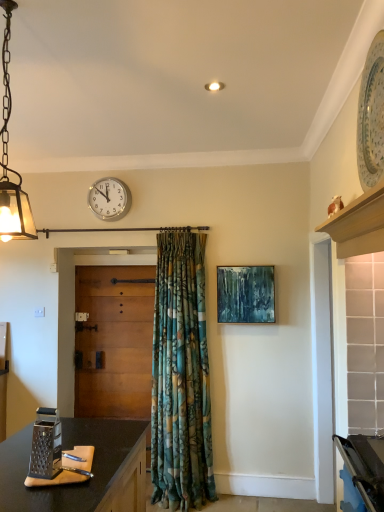
Question: From the image's perspective, is wooden door at center located above or below matte glass pendant light at left?

Choices:
 (A) below
 (B) above

Answer: (A)

Question: Looking at the image, does wooden door at center seem bigger or smaller compared to matte glass pendant light at left?

Choices:
 (A) big
 (B) small

Answer: (A)

Question: Estimate the real-world distances between objects in this image. Which object is closer to the wooden door at center?

Choices:
 (A) metallic grater at lower left
 (B) white plastic wall clock at upper center
 (C) matte glass pendant light at left
 (D) teal textured canvas at center

Answer: (B)

Question: Estimate the real-world distances between objects in this image. Which object is farther from the white plastic wall clock at upper center?

Choices:
 (A) teal textured canvas at center
 (B) wooden door at center
 (C) metallic grater at lower left
 (D) matte glass pendant light at left

Answer: (C)